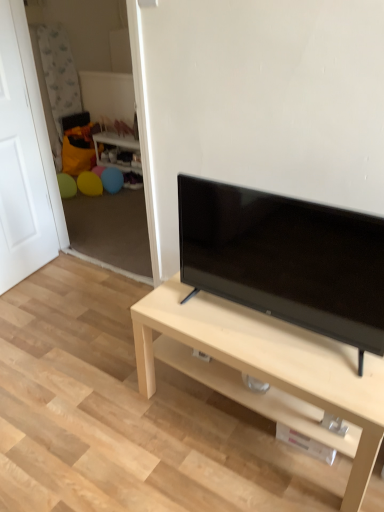
Question: Relative to black glossy tv at center, is light wood/finish tv stand at center in front or behind?

Choices:
 (A) front
 (B) behind

Answer: (B)

Question: In terms of width, does light wood/finish tv stand at center look wider or thinner when compared to black glossy tv at center?

Choices:
 (A) thin
 (B) wide

Answer: (B)

Question: Estimate the real-world distances between objects in this image. Which object is closer to the light wood/finish tv stand at center?

Choices:
 (A) white matte door at left
 (B) wooden side table at center
 (C) black glossy tv at center

Answer: (C)

Question: Based on their relative distances, which object is nearer to the wooden side table at center?

Choices:
 (A) light wood/finish tv stand at center
 (B) black glossy tv at center
 (C) white matte door at left

Answer: (C)